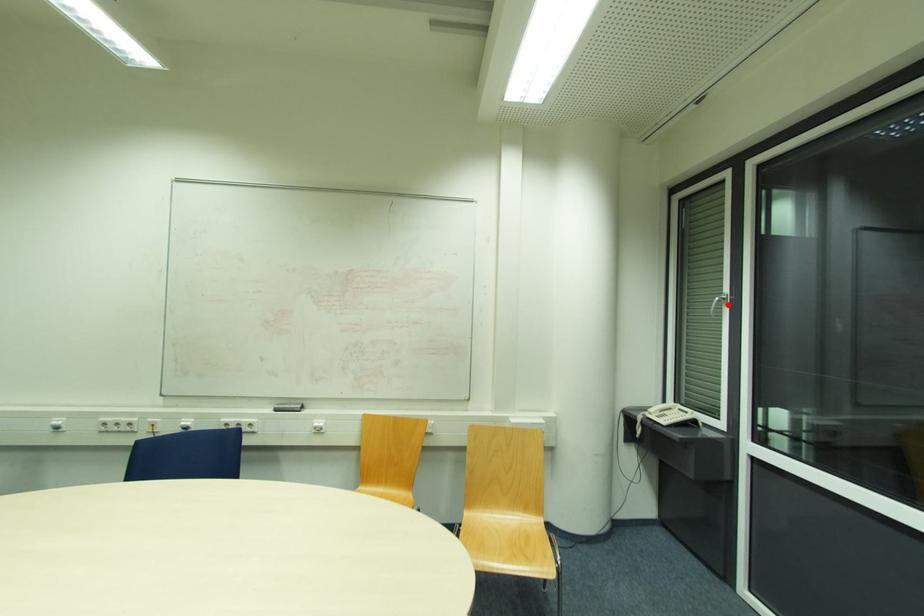
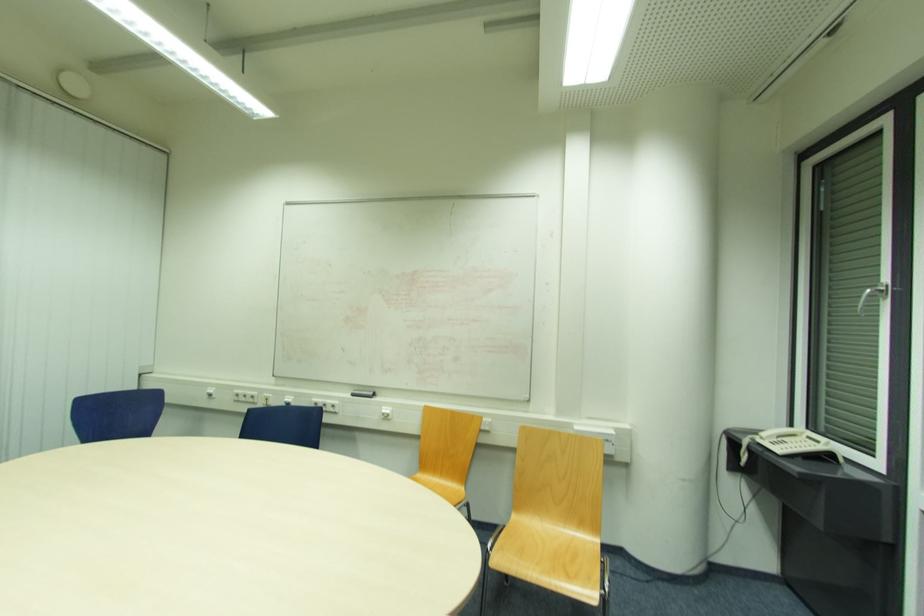
The point at the highlighted location is marked in the first image. Where is the corresponding point in the second image?

(883, 297)